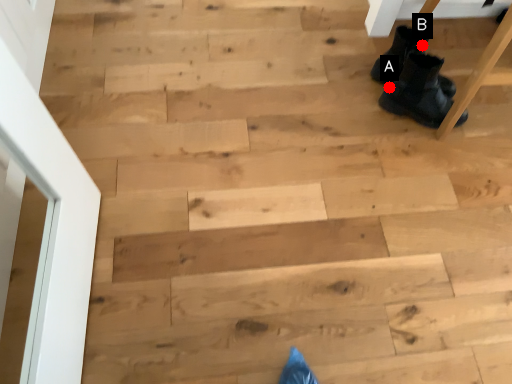
Question: Two points are circled on the image, labeled by A and B beside each circle. Which point is farther from the camera taking this photo?

Choices:
 (A) A is further
 (B) B is further

Answer: (A)